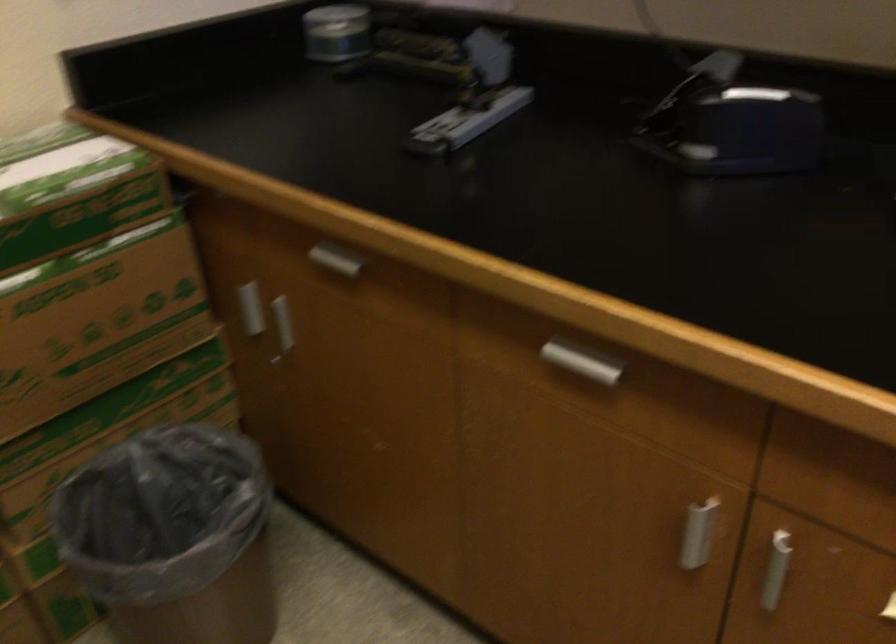
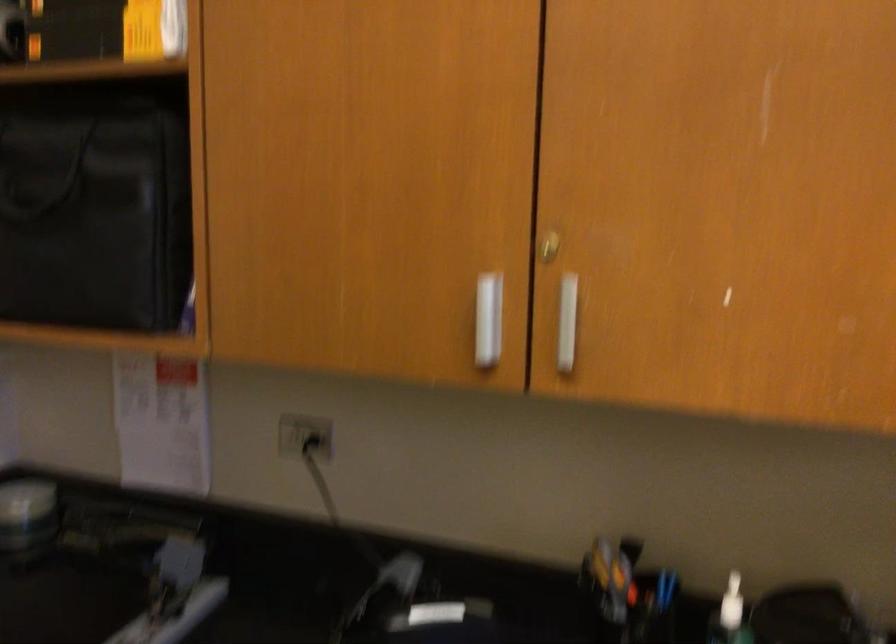
How did the camera likely rotate?

The rotation direction of the camera is right-up.